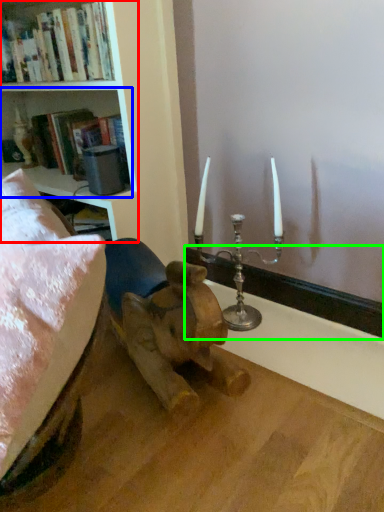
Question: Based on their relative distances, which object is farther from bookcase (highlighted by a red box)? Choose from shelf (highlighted by a blue box) and window sill (highlighted by a green box).

Choices:
 (A) shelf
 (B) window sill

Answer: (B)